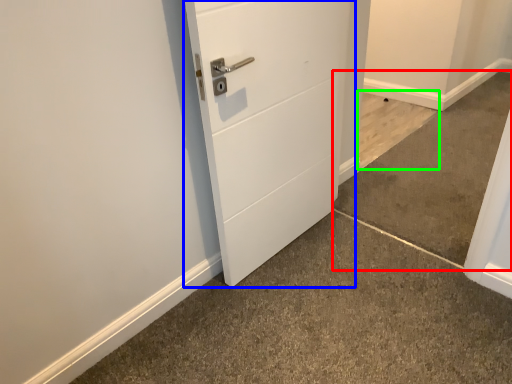
Question: Considering the real-world distances, which object is farthest from concrete (highlighted by a red box)? door (highlighted by a blue box) or concrete (highlighted by a green box)?

Choices:
 (A) door
 (B) concrete

Answer: (A)